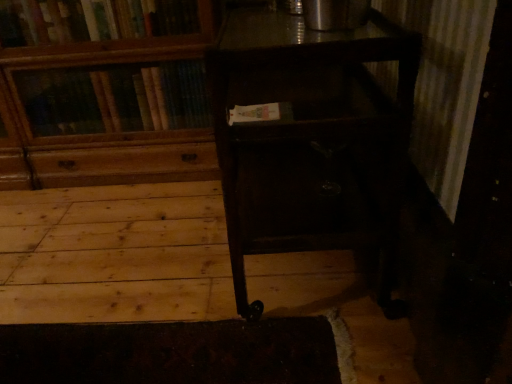
Image resolution: width=512 pixels, height=384 pixels. I want to click on wooden bookcase at upper left, so click(x=104, y=92).

Image resolution: width=512 pixels, height=384 pixels. What do you see at coordinates (104, 92) in the screenshot?
I see `wooden bookcase at upper left` at bounding box center [104, 92].

This screenshot has width=512, height=384. I want to click on dark wood table at center, so click(x=311, y=139).

The width and height of the screenshot is (512, 384). What do you see at coordinates (311, 139) in the screenshot? I see `dark wood table at center` at bounding box center [311, 139].

You are a GUI agent. You are given a task and a screenshot of the screen. Output one action in this format:
    pyautogui.click(x=<x>, y=<y>)
    Task: Click on the wooden bookcase at upper left
    This screenshot has width=512, height=384.
    Given the screenshot: What is the action you would take?
    pyautogui.click(x=104, y=92)

Is dark wood table at center at the left side of wooden bookcase at upper left?

In fact, dark wood table at center is to the right of wooden bookcase at upper left.

Who is more distant, dark wood table at center or wooden bookcase at upper left?

Positioned behind is wooden bookcase at upper left.

Does point (336, 130) come in front of point (65, 165)?

Yes, point (336, 130) is closer to viewer.

From the image's perspective, which one is positioned higher, dark wood table at center or wooden bookcase at upper left?

wooden bookcase at upper left is shown above in the image.

From a real-world perspective, which object rests below the other?

dark wood table at center is physically lower.

Which object is wider, dark wood table at center or wooden bookcase at upper left?

dark wood table at center is wider.

Which of these two, dark wood table at center or wooden bookcase at upper left, stands shorter?

dark wood table at center.

Considering the relative sizes of dark wood table at center and wooden bookcase at upper left in the image provided, is dark wood table at center smaller than wooden bookcase at upper left?

Indeed, dark wood table at center has a smaller size compared to wooden bookcase at upper left.

Consider the image. Can wooden bookcase at upper left be found inside dark wood table at center?

No, wooden bookcase at upper left is located outside of dark wood table at center.

Is dark wood table at center touching wooden bookcase at upper left?

No, dark wood table at center is not next to wooden bookcase at upper left.

Is dark wood table at center positioned with its back to wooden bookcase at upper left?

No.

The width and height of the screenshot is (512, 384). What are the coordinates of `bookcase lying above the dark wood table at center (from the image's perspective)` in the screenshot? It's located at (104, 92).

Is wooden bookcase at upper left to the right of dark wood table at center from the viewer's perspective?

No.

Is wooden bookcase at upper left further to the viewer compared to dark wood table at center?

That is True.

Between point (207, 3) and point (324, 219), which one is positioned in front?

The point (324, 219) is closer.

From the image's perspective, is wooden bookcase at upper left located above dark wood table at center?

Yes, from the image's perspective, wooden bookcase at upper left is over dark wood table at center.

From a real-world perspective, between wooden bookcase at upper left and dark wood table at center, who is vertically higher?

From a 3D spatial view, wooden bookcase at upper left is above.

Considering the relative sizes of wooden bookcase at upper left and dark wood table at center in the image provided, is wooden bookcase at upper left thinner than dark wood table at center?

Indeed, wooden bookcase at upper left has a lesser width compared to dark wood table at center.

Between wooden bookcase at upper left and dark wood table at center, which one has less height?

dark wood table at center.

Looking at the image, does wooden bookcase at upper left seem bigger or smaller compared to dark wood table at center?

wooden bookcase at upper left is bigger than dark wood table at center.

Is dark wood table at center located within wooden bookcase at upper left?

No, wooden bookcase at upper left does not contain dark wood table at center.

Would you say wooden bookcase at upper left is a long distance from dark wood table at center?

wooden bookcase at upper left is actually quite close to dark wood table at center.

Could you tell me if wooden bookcase at upper left is facing dark wood table at center?

No, wooden bookcase at upper left does not turn towards dark wood table at center.

How many degrees apart are the facing directions of wooden bookcase at upper left and dark wood table at center?

The angular difference between wooden bookcase at upper left and dark wood table at center is 91.3 degrees.

This screenshot has height=384, width=512. Find the location of `table to the right of wooden bookcase at upper left`. table to the right of wooden bookcase at upper left is located at coordinates (311, 139).

Where is `bookcase that appears above the dark wood table at center (from the image's perspective)`? The width and height of the screenshot is (512, 384). bookcase that appears above the dark wood table at center (from the image's perspective) is located at coordinates (104, 92).

Find the location of `bookcase on the left side of dark wood table at center`. bookcase on the left side of dark wood table at center is located at coordinates pos(104,92).